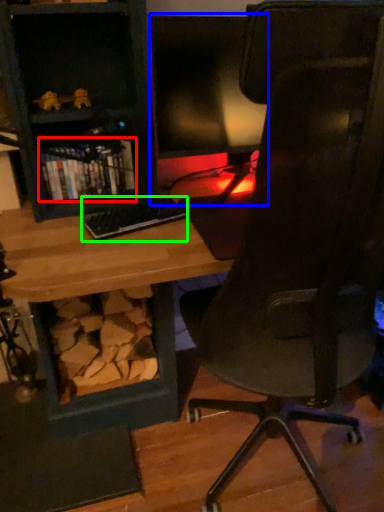
Question: Which is farther away from book (highlighted by a red box)? computer monitor (highlighted by a blue box) or keyboard (highlighted by a green box)?

Choices:
 (A) computer monitor
 (B) keyboard

Answer: (A)